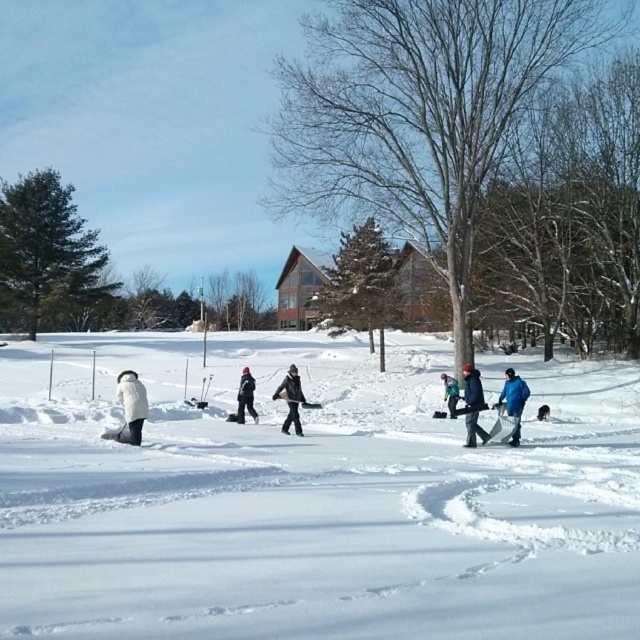
Is blue fabric jacket at center-right to the left of dark gray snowsuit at center from the viewer's perspective?

In fact, blue fabric jacket at center-right is to the right of dark gray snowsuit at center.

Can you confirm if blue fabric jacket at center-right is bigger than dark gray snowsuit at center?

Actually, blue fabric jacket at center-right might be smaller than dark gray snowsuit at center.

Does point (506, 392) come in front of point (285, 432)?

Yes, it is.

The width and height of the screenshot is (640, 640). I want to click on blue fabric jacket at center-right, so click(513, 401).

Can you confirm if blue fabric jacket at center-right is smaller than black matte jacket at center?

Yes, blue fabric jacket at center-right is smaller than black matte jacket at center.

How far apart are blue fabric jacket at center-right and black matte jacket at center?

A distance of 9.62 meters exists between blue fabric jacket at center-right and black matte jacket at center.

At what (x,y) coordinates should I click in order to perform the action: click on blue fabric jacket at center-right. Please return your answer as a coordinate pair (x, y). Looking at the image, I should click on (513, 401).

Is point (253, 449) farther from viewer compared to point (481, 438)?

That is False.

Which is in front, point (307, 454) or point (476, 408)?

Point (307, 454)

Is point (538, 502) positioned before point (476, 420)?

Yes, point (538, 502) is closer to viewer.

At what (x,y) coordinates should I click in order to perform the action: click on white fluffy snow at center. Please return your answer as a coordinate pair (x, y). Image resolution: width=640 pixels, height=640 pixels. Looking at the image, I should click on click(x=310, y=497).